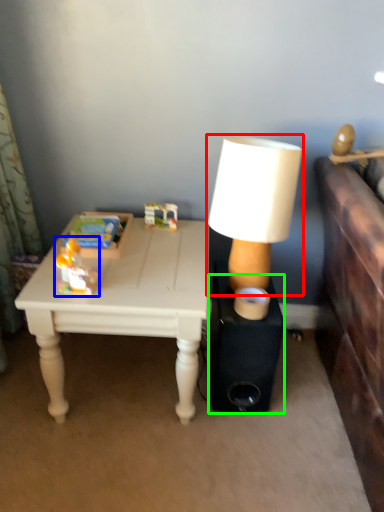
Question: Which is nearer to the lamp (highlighted by a red box)? toy (highlighted by a blue box) or speaker (highlighted by a green box).

Choices:
 (A) toy
 (B) speaker

Answer: (B)